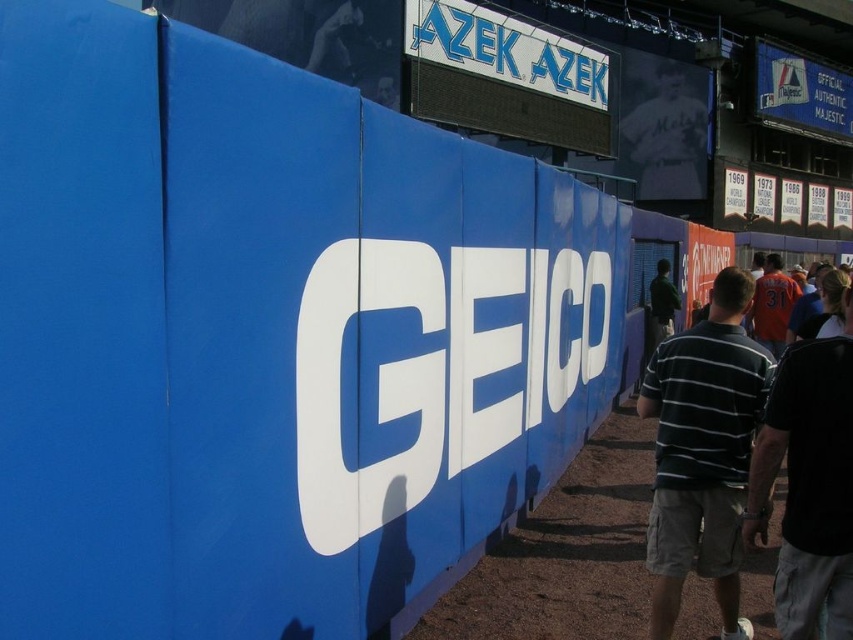
You are a photographer at the baseball stadium. You need to capture a photo that includes both the striped cotton shirt at right and the white jersey at upper center. Which one should you adjust your camera angle to focus on first to ensure both are in frame?

The striped cotton shirt at right is located below the white jersey at upper center, so you should focus on the white jersey at upper center first to ensure both are in frame.

You are a photographer positioned at the center of the baseball stadium. You notice a white jersey at upper center and a blue fabric sign at upper right in your viewfinder. Which object appears taller in the image?

The white jersey at upper center is taller than the blue fabric sign at upper right according to the description.

You are a photographer at the baseball stadium and want to capture both the white jersey at upper center and the blue fabric sign at upper right in a single shot. Based on their positions, which object should you focus on first to ensure both are in frame?

The white jersey at upper center is located below the blue fabric sign at upper right, so you should focus on the blue fabric sign at upper right first to ensure both are in frame.